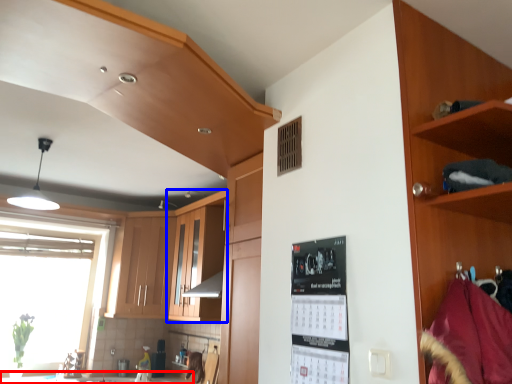
Question: Which object appears closest to the camera in this image, counter top (highlighted by a red box) or cabinetry (highlighted by a blue box)?

Choices:
 (A) counter top
 (B) cabinetry

Answer: (A)